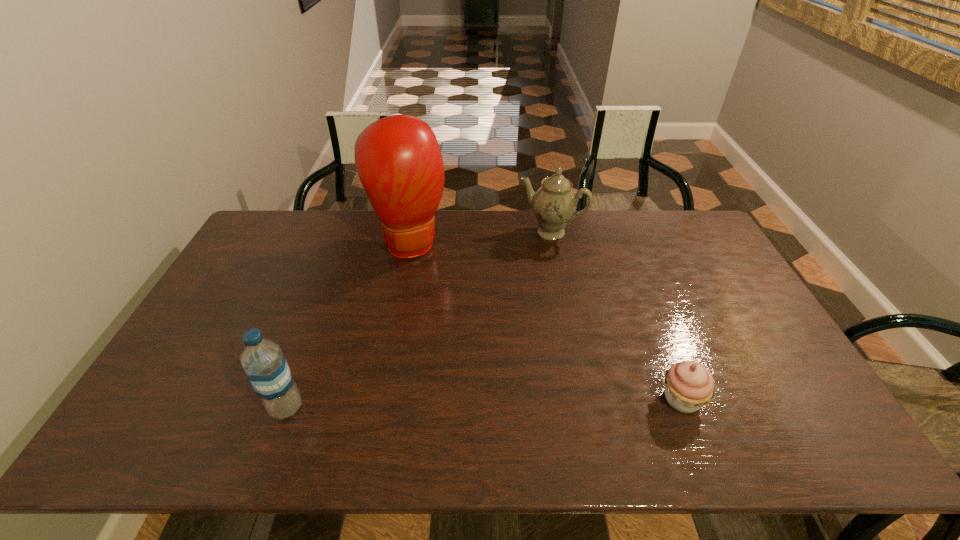
Where is `vacant spot on the desktop that is between the water bottle and the cupcake and is positioned on the striking surface of the second object from left to right`? The height and width of the screenshot is (540, 960). vacant spot on the desktop that is between the water bottle and the cupcake and is positioned on the striking surface of the second object from left to right is located at coordinates (489, 403).

The image size is (960, 540). I want to click on free spot on the desktop that is between the leftmost object and the shortest object and is positioned on the spout of the chinaware, so click(454, 403).